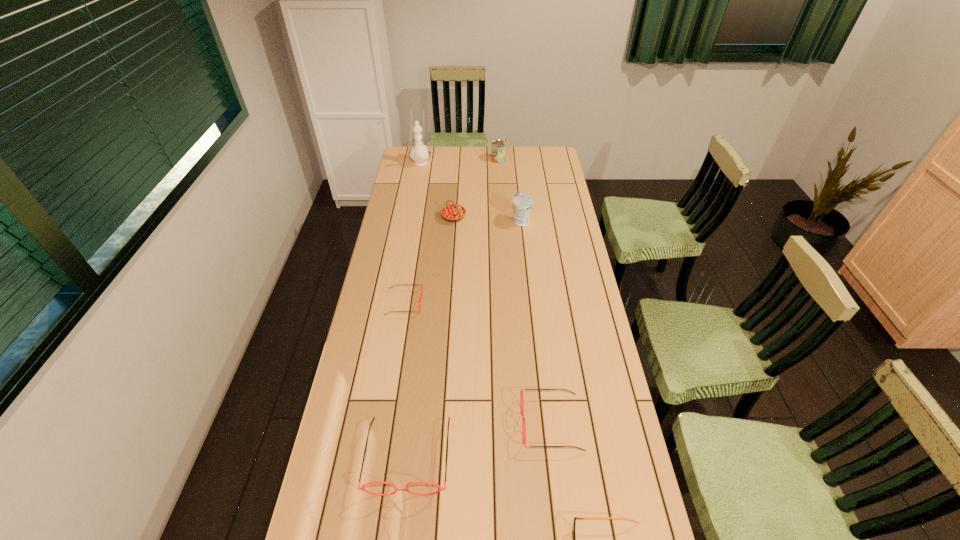
Identify the location of free point located 0.120m at the spout of the tallest object. The height and width of the screenshot is (540, 960). (417, 185).

This screenshot has height=540, width=960. I want to click on free space located on the front of the can, so click(x=499, y=181).

At what (x,y) coordinates should I click in order to perform the action: click on free space located 0.390m on the left of the yogurt. Please return your answer as a coordinate pair (x, y). The height and width of the screenshot is (540, 960). Looking at the image, I should click on (423, 221).

The image size is (960, 540). Identify the location of vacant space located on the front of the strawberry. (452, 233).

The width and height of the screenshot is (960, 540). I want to click on vacant position located 0.370m on the front-facing side of the third shortest spectacles, so click(x=395, y=423).

Identify the location of free spot located 0.230m on the front-facing side of the third shortest spectacles. (443, 423).

This screenshot has width=960, height=540. I want to click on vacant point located on the front-facing side of the third shortest spectacles, so click(405, 423).

I want to click on free spot located 0.300m on the front-facing side of the farthest red spectacles, so click(503, 303).

This screenshot has height=540, width=960. What are the coordinates of `chinaware at the far edge` in the screenshot? It's located at (419, 153).

Locate an element on the screen. This screenshot has height=540, width=960. can at the far edge is located at coordinates (498, 154).